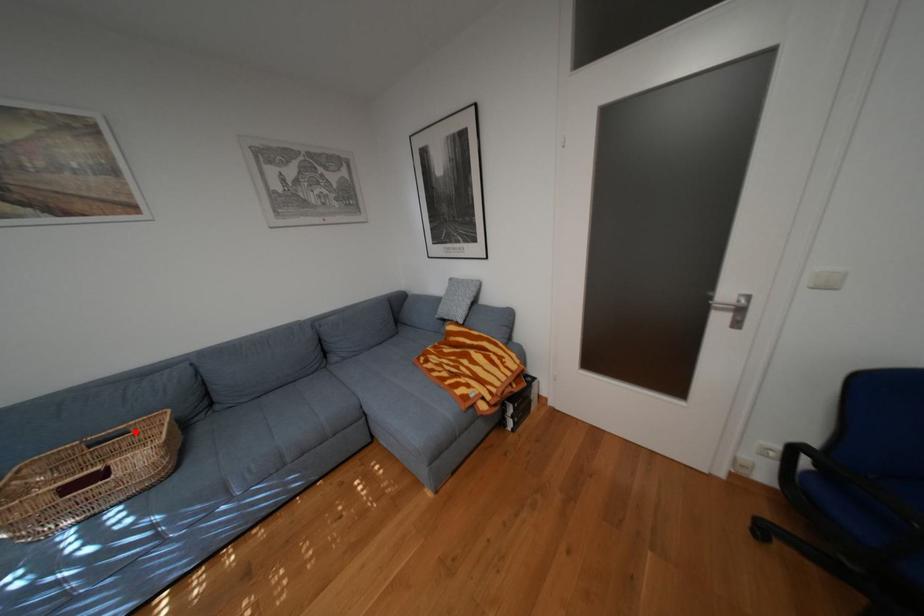
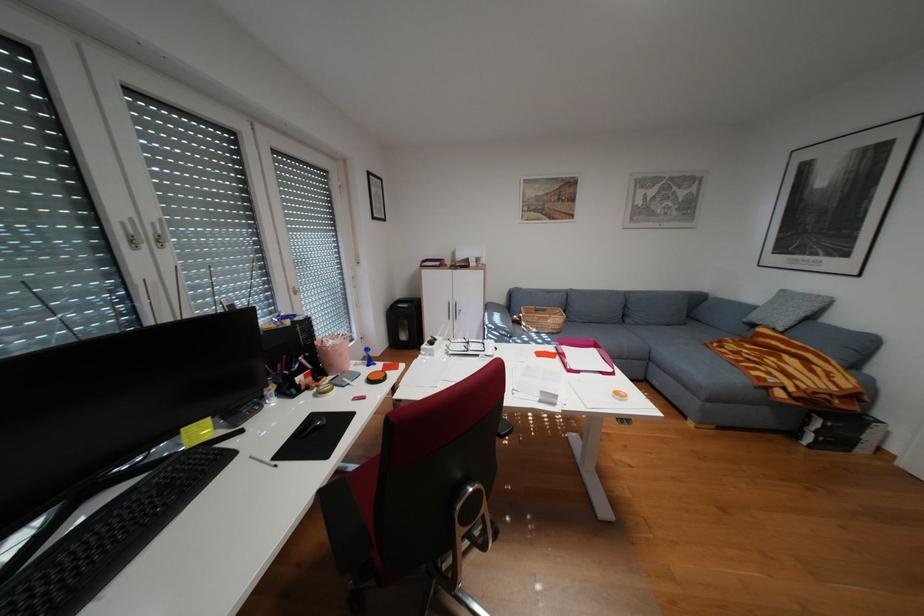
Where in the second image is the point corresponding to the highlighted location from the first image?

(556, 310)